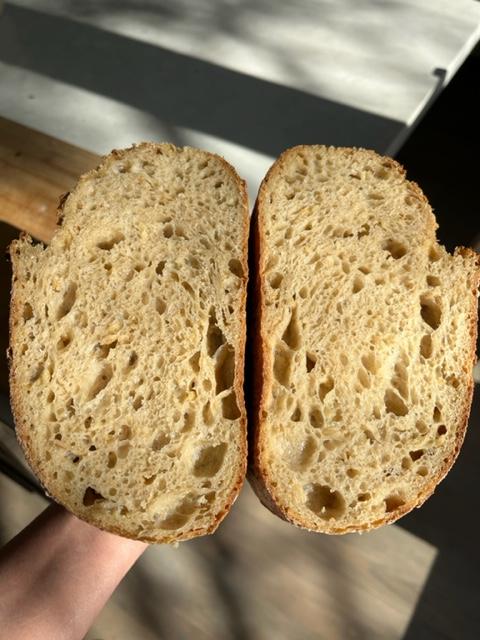
Identify the location of wooden floor. (304, 568), (370, 555), (115, 626).